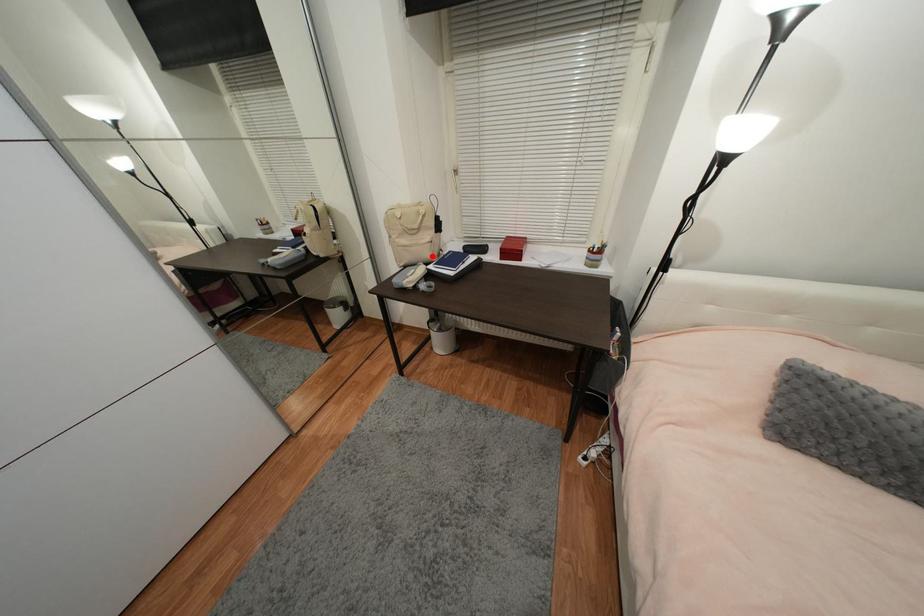
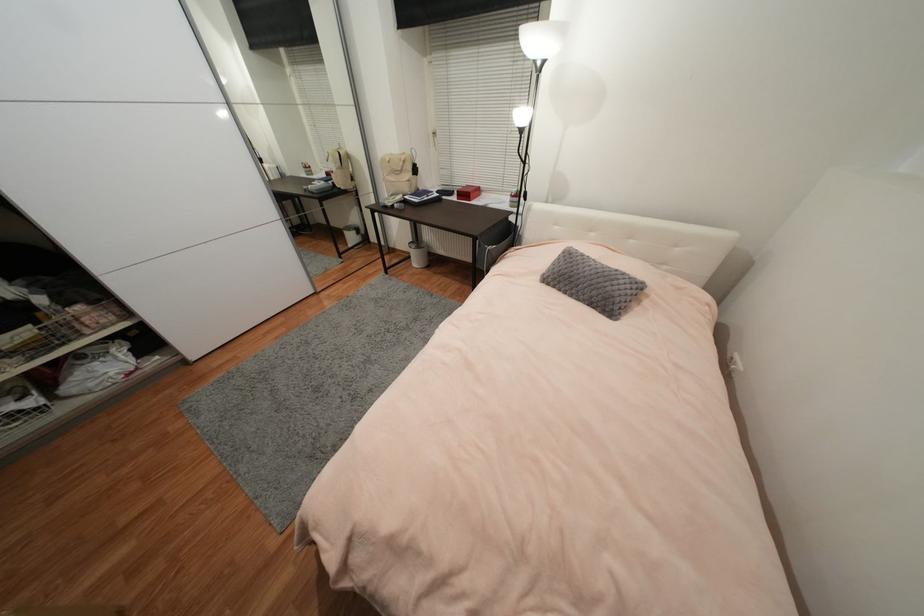
Where in the second image is the point corresponding to the highlighted location from the first image?

(410, 191)